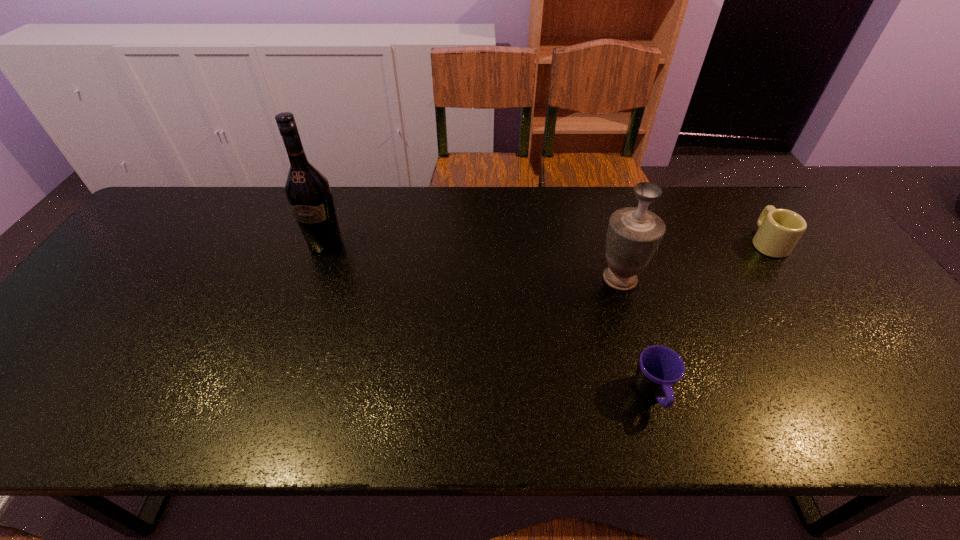
This screenshot has width=960, height=540. In order to click on free region at the far left corner in this screenshot , I will do `click(180, 225)`.

Where is `free spot between the leftmost object and the farther mug`? The image size is (960, 540). free spot between the leftmost object and the farther mug is located at coordinates (546, 242).

This screenshot has height=540, width=960. Identify the location of free space that is in between the right mug and the nearer mug. (710, 318).

Where is `vacant region between the rightmost object and the tallest object`? The image size is (960, 540). vacant region between the rightmost object and the tallest object is located at coordinates (546, 242).

The width and height of the screenshot is (960, 540). I want to click on free point between the third farthest object and the leftmost object, so click(472, 261).

Identify the location of free spot between the tallest object and the right mug. The image size is (960, 540). (546, 242).

At what (x,y) coordinates should I click in order to perform the action: click on free space between the tallest object and the urn. Please return your answer as a coordinate pair (x, y). Looking at the image, I should click on pyautogui.click(x=472, y=261).

Image resolution: width=960 pixels, height=540 pixels. What are the coordinates of `vacant region between the urn and the rightmost object` in the screenshot? It's located at (693, 260).

Locate an element on the screen. This screenshot has height=540, width=960. unoccupied area between the second tallest object and the nearer mug is located at coordinates (636, 336).

Find the location of a particular element. empty space between the tallest object and the urn is located at coordinates (472, 261).